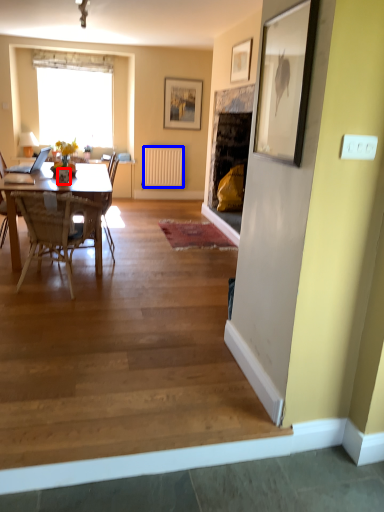
Question: Which object is closer to the camera taking this photo, vase (highlighted by a red box) or radiator (highlighted by a blue box)?

Choices:
 (A) vase
 (B) radiator

Answer: (A)